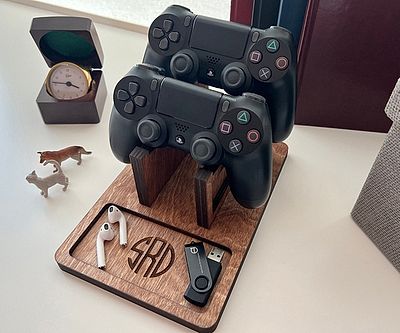
At what (x,y) coordinates should I click in order to perform the action: click on engraved 'srd' logo into the wooden stand. Please return your answer as a coordinate pair (x, y). Looking at the image, I should click on (149, 257).